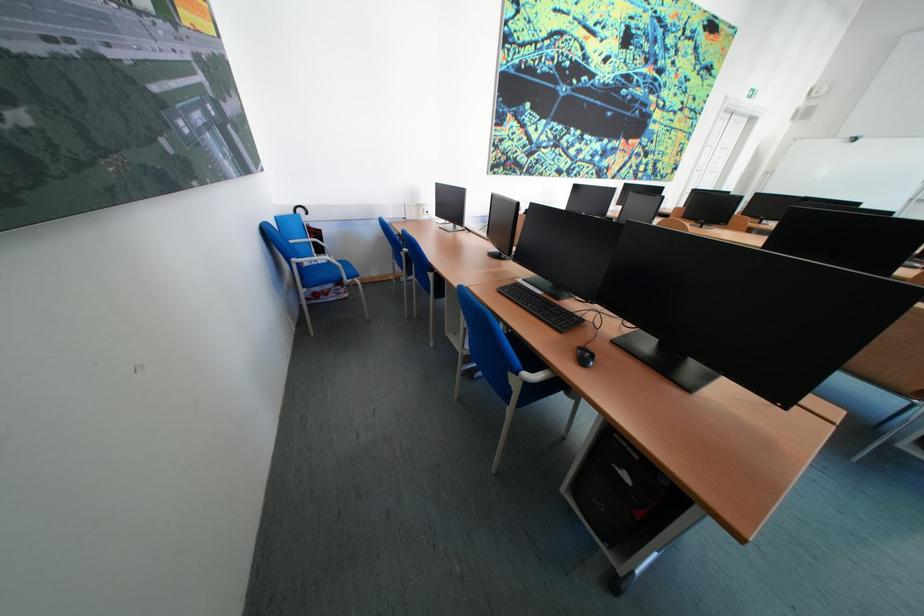
Find where to lift the black umbrella handle. Please return your answer as a coordinate pair (x, y).

(299, 209)